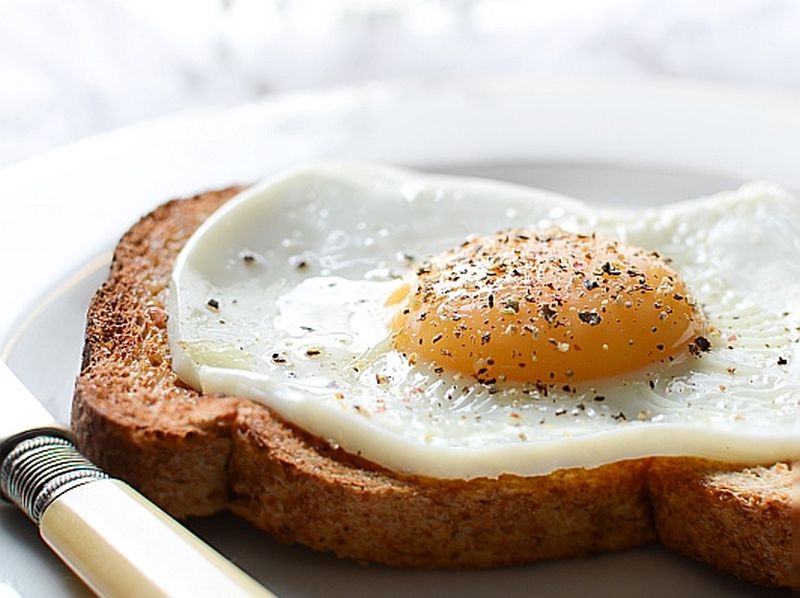
Locate an element on the screen. The image size is (800, 598). handle is located at coordinates (122, 552).